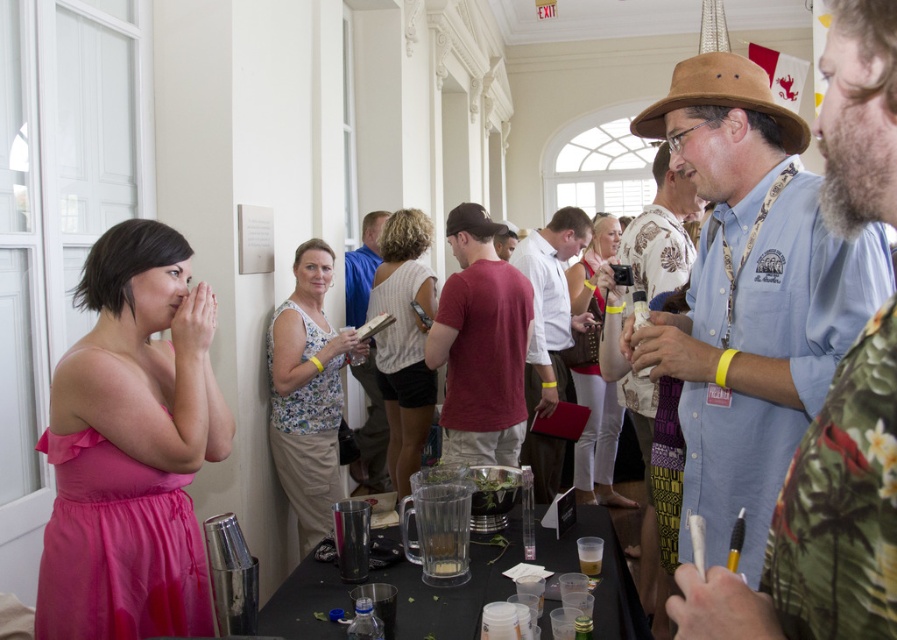
You are a photographer at this event and need to capture a candid shot of both the pink satin dress at left and the white shirt at center. Since the dress is shorter, will you position your camera higher or lower to ensure both are fully visible in the frame?

Since the pink satin dress at left is shorter than the white shirt at center, you should position your camera lower to ensure both are fully visible in the frame.